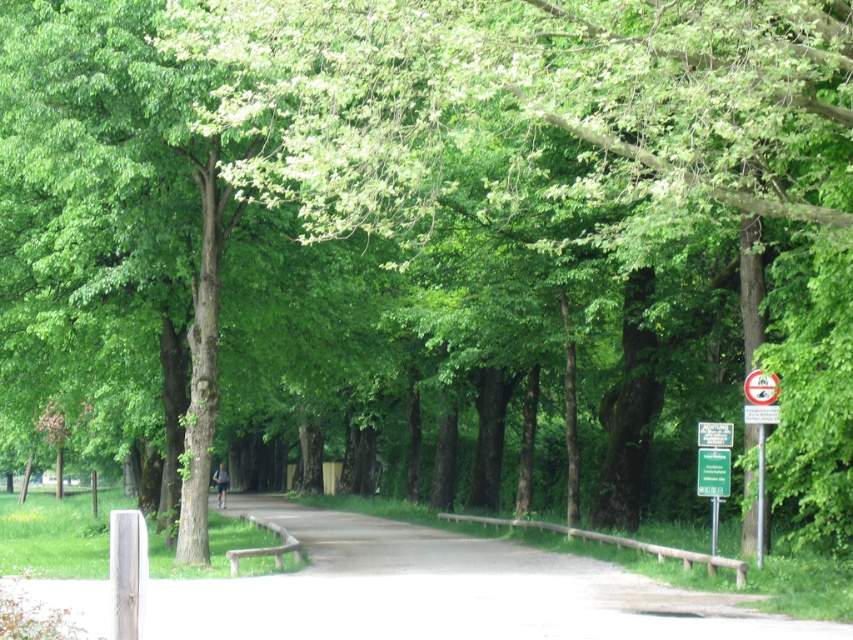
Who is positioned more to the right, wooden bench at center or white plastic sign at upper right?

white plastic sign at upper right

Is wooden bench at center shorter than white plastic sign at upper right?

Incorrect, wooden bench at center's height does not fall short of white plastic sign at upper right's.

Does point (279, 538) come farther from viewer compared to point (747, 387)?

Yes.

You are a GUI agent. You are given a task and a screenshot of the screen. Output one action in this format:
    pyautogui.click(x=<x>, y=<y>)
    Task: Click on the wooden bench at center
    This screenshot has height=640, width=853.
    Given the screenshot: What is the action you would take?
    pyautogui.click(x=265, y=547)

Who is lower down, smooth asphalt path at center or wooden bench at center?

Positioned lower is wooden bench at center.

Does smooth asphalt path at center have a lesser width compared to wooden bench at center?

No, smooth asphalt path at center is not thinner than wooden bench at center.

Does point (254, 621) lie behind point (281, 560)?

No, (254, 621) is in front of (281, 560).

The width and height of the screenshot is (853, 640). I want to click on smooth asphalt path at center, so click(445, 592).

Who is positioned more to the left, smooth asphalt path at center or white plastic sign at upper right?

smooth asphalt path at center

Who is lower down, smooth asphalt path at center or white plastic sign at upper right?

Positioned lower is smooth asphalt path at center.

Who is more forward, (173, 600) or (767, 400)?

Point (173, 600) is more forward.

You are a GUI agent. You are given a task and a screenshot of the screen. Output one action in this format:
    pyautogui.click(x=<x>, y=<y>)
    Task: Click on the smooth asphalt path at center
    The image size is (853, 640).
    Given the screenshot: What is the action you would take?
    pyautogui.click(x=445, y=592)